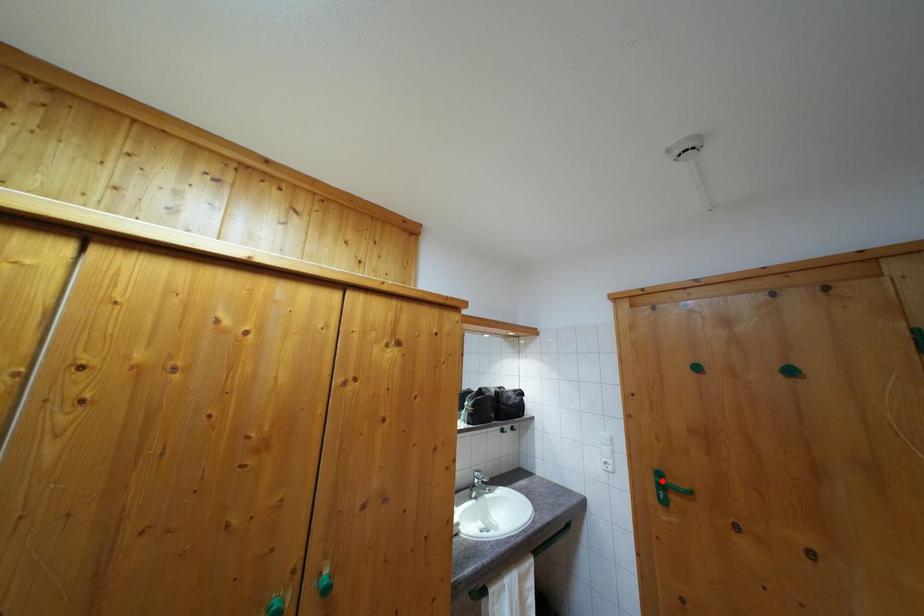
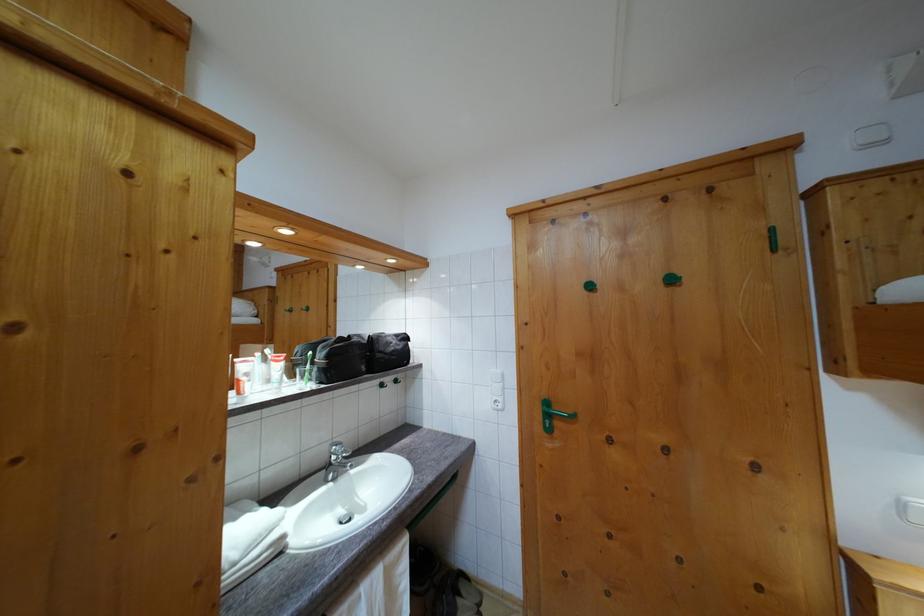
Where in the second image is the point corresponding to the highlighted location from the first image?

(551, 410)